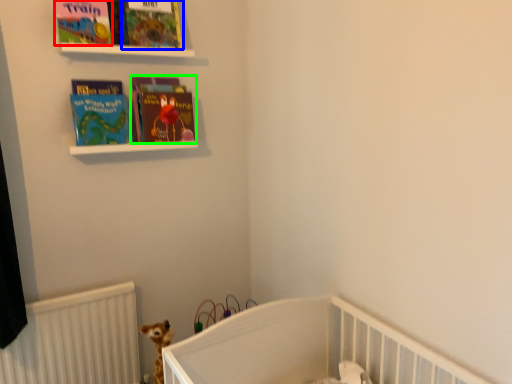
Question: Based on their relative distances, which object is nearer to book cover (highlighted by a red box)? Choose from book cover (highlighted by a blue box) and book (highlighted by a green box).

Choices:
 (A) book cover
 (B) book

Answer: (A)